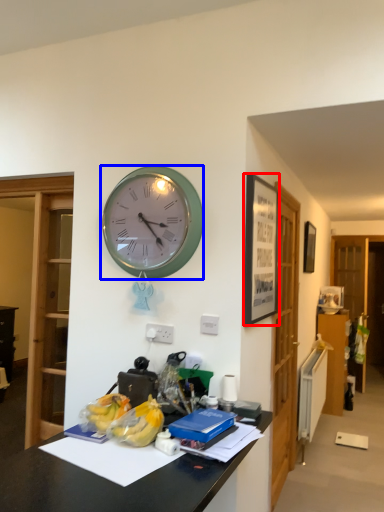
Question: Which of the following is the farthest to the observer, picture frame (highlighted by a red box) or wall clock (highlighted by a blue box)?

Choices:
 (A) picture frame
 (B) wall clock

Answer: (B)